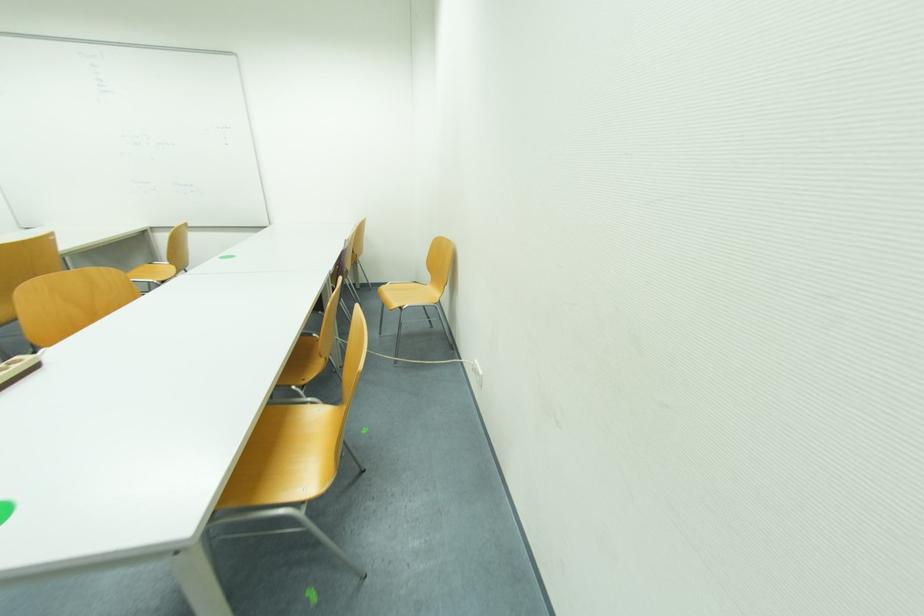
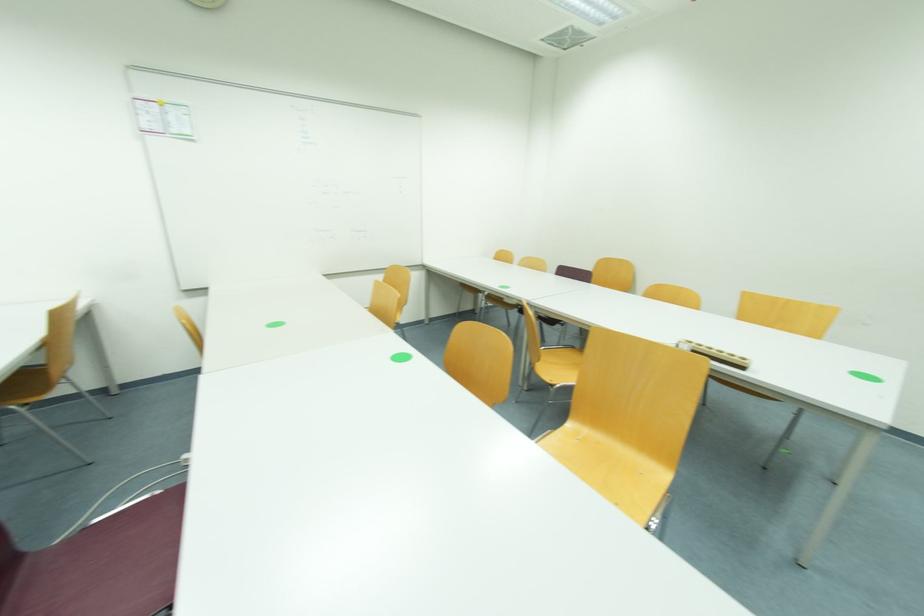
Question: Which direction would the cameraman need to move to produce the second image? Reply with the corresponding letter.

Choices:
 (A) Left
 (B) Right
 (C) Forward
 (D) Backward

Answer: (A)